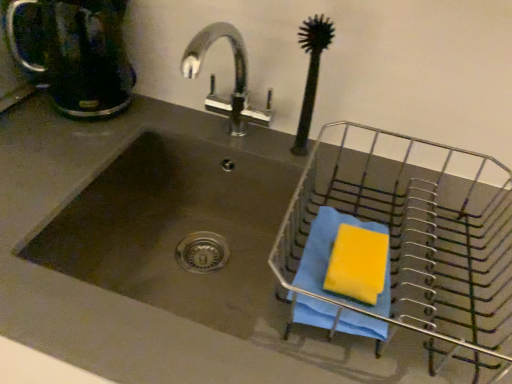
Measure the distance between point (313, 100) and camera.

The distance of point (313, 100) from camera is 30.39 inches.

Measure the distance between yellow sponge at right and camera.

yellow sponge at right and camera are 52.65 centimeters apart.

Image resolution: width=512 pixels, height=384 pixels. Find the location of `yellow sponge at right`. yellow sponge at right is located at coordinates (357, 264).

Find the location of a particular element. The image size is (512, 384). matte black coffeepot at upper left is located at coordinates (79, 55).

Is black rubber brush at upper right oriented towards yellow sponge at right?

No.

Does point (321, 29) lie in front of point (350, 252)?

No, (321, 29) is behind (350, 252).

Between black rubber brush at upper right and yellow sponge at right, which one has larger size?

black rubber brush at upper right is bigger.

Which object is further away from the camera, black rubber brush at upper right or yellow sponge at right?

black rubber brush at upper right.

Considering the sizes of objects matte black coffeepot at upper left and yellow sponge at right in the image provided, who is wider, matte black coffeepot at upper left or yellow sponge at right?

matte black coffeepot at upper left.

Is matte black coffeepot at upper left placed right next to yellow sponge at right?

matte black coffeepot at upper left is not next to yellow sponge at right, and they're not touching.

Which object is further away from the camera taking this photo, matte black coffeepot at upper left or yellow sponge at right?

matte black coffeepot at upper left is behind.

How distant is metallic wire basket at right from blue cloth at right?

metallic wire basket at right is 5.51 inches away from blue cloth at right.

From a real-world perspective, does metallic wire basket at right stand above blue cloth at right?

Correct, in the physical world, metallic wire basket at right is higher than blue cloth at right.

Considering the positions of points (492, 201) and (316, 256), is point (492, 201) closer to camera compared to point (316, 256)?

No, (492, 201) is further to viewer.

From the picture: From the image's perspective, which object appears higher, metallic wire basket at right or blue cloth at right?

metallic wire basket at right appears higher in the image.

From the image's perspective, is black rubber brush at upper right above or below metallic wire basket at right?

Based on their image positions, black rubber brush at upper right is located above metallic wire basket at right.

Consider the image. Is black rubber brush at upper right positioned far away from metallic wire basket at right?

black rubber brush at upper right is actually quite close to metallic wire basket at right.

Is black rubber brush at upper right not within metallic wire basket at right?

That's correct, black rubber brush at upper right is outside of metallic wire basket at right.

Could you tell me if black rubber brush at upper right is turned towards metallic wire basket at right?

No, black rubber brush at upper right does not turn towards metallic wire basket at right.

How many degrees apart are the facing directions of blue cloth at right and metallic wire basket at right?

The angle between the facing direction of blue cloth at right and the facing direction of metallic wire basket at right is 2.96e-06 degrees.

I want to click on beach towel that is behind the metallic wire basket at right, so click(330, 256).

Is blue cloth at right located outside metallic wire basket at right?

Actually, blue cloth at right is at least partially inside metallic wire basket at right.

Is blue cloth at right facing towards metallic wire basket at right?

Yes, blue cloth at right is turned towards metallic wire basket at right.

Is metallic wire basket at right located within matte black coffeepot at upper left?

Definitely not — metallic wire basket at right is not inside matte black coffeepot at upper left.

Does matte black coffeepot at upper left come in front of metallic wire basket at right?

No, matte black coffeepot at upper left is behind metallic wire basket at right.

From the image's perspective, is matte black coffeepot at upper left beneath metallic wire basket at right?

No.

Considering the relative sizes of matte black coffeepot at upper left and black rubber brush at upper right in the image provided, is matte black coffeepot at upper left thinner than black rubber brush at upper right?

No.

From the picture: Is matte black coffeepot at upper left aimed at black rubber brush at upper right?

No, matte black coffeepot at upper left is not turned towards black rubber brush at upper right.

Which is more distant, (x=81, y=39) or (x=305, y=31)?

Point (x=81, y=39)

Would you say matte black coffeepot at upper left is inside or outside black rubber brush at upper right?

matte black coffeepot at upper left cannot be found inside black rubber brush at upper right.

In the image, there is a yellow sponge at right. Find the location of `brush above it (from the image's perspective)`. brush above it (from the image's perspective) is located at coordinates (311, 73).

The image size is (512, 384). In the image, there is a matte black coffeepot at upper left. Identify the location of soap below it (from the image's perspective). (357, 264).

Considering their positions, is black rubber brush at upper right positioned closer to yellow sponge at right than stainless steel sink at center?

black rubber brush at upper right lies closer to yellow sponge at right than the other object.

When comparing their distances from blue cloth at right, does metallic wire basket at right or yellow sponge at right seem closer?

yellow sponge at right lies closer to blue cloth at right than the other object.

Based on their spatial positions, is matte black coffeepot at upper left or blue cloth at right closer to metallic wire basket at right?

Among the two, blue cloth at right is located nearer to metallic wire basket at right.

From the image, which object appears to be farther from metallic wire basket at right, stainless steel sink at center or yellow sponge at right?

The object further to metallic wire basket at right is stainless steel sink at center.

When comparing their distances from blue cloth at right, does black rubber brush at upper right or matte black coffeepot at upper left seem closer?

black rubber brush at upper right.

When comparing their distances from yellow sponge at right, does metallic wire basket at right or stainless steel sink at center seem further?

Among the two, stainless steel sink at center is located further to yellow sponge at right.

In the scene shown: From the image, which object appears to be farther from black rubber brush at upper right, metallic wire basket at right or matte black coffeepot at upper left?

Among the two, matte black coffeepot at upper left is located further to black rubber brush at upper right.

Which object lies further to the anchor point matte black coffeepot at upper left, stainless steel sink at center or black rubber brush at upper right?

The object further to matte black coffeepot at upper left is black rubber brush at upper right.

Identify the location of brush situated between matte black coffeepot at upper left and yellow sponge at right from left to right. (311, 73).

At what (x,y) coordinates should I click in order to perform the action: click on brush between matte black coffeepot at upper left and metallic wire basket at right in the horizontal direction. Please return your answer as a coordinate pair (x, y). The height and width of the screenshot is (384, 512). Looking at the image, I should click on (311, 73).

Identify the location of brush between stainless steel sink at center and metallic wire basket at right. (311, 73).

You are a GUI agent. You are given a task and a screenshot of the screen. Output one action in this format:
    pyautogui.click(x=<x>, y=<y>)
    Task: Click on the sink between matte black coffeepot at upper left and yellow sponge at right in the horizontal direction
    Image resolution: width=512 pixels, height=384 pixels.
    Given the screenshot: What is the action you would take?
    pyautogui.click(x=180, y=222)